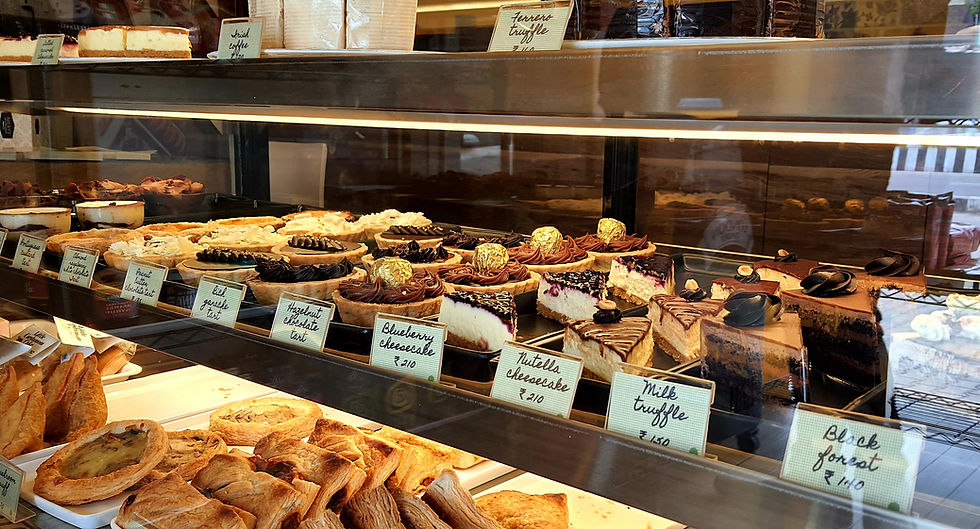
The height and width of the screenshot is (529, 980). In order to click on white trays in this screenshot , I will do `click(148, 388)`, `click(595, 513)`, `click(487, 474)`.